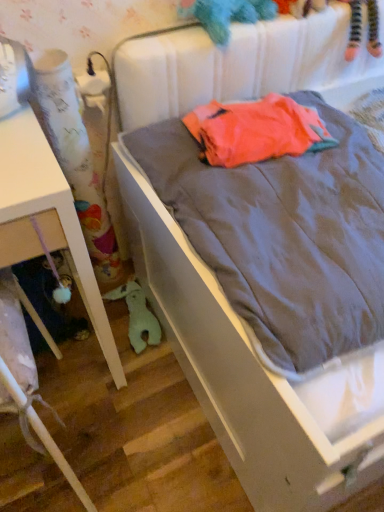
You are a GUI agent. You are given a task and a screenshot of the screen. Output one action in this format:
    pyautogui.click(x=<x>, y=<y>)
    Task: Click on the free location in front of neon orange fabric at center
    Image resolution: width=384 pixels, height=512 pixels.
    Given the screenshot: What is the action you would take?
    pyautogui.click(x=275, y=216)